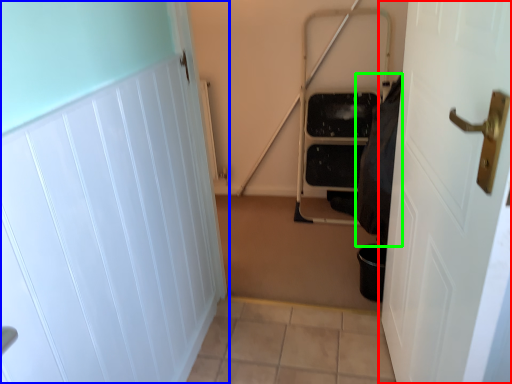
Question: Estimate the real-world distances between objects in this image. Which object is closer to door (highlighted by a red box), door (highlighted by a blue box) or material (highlighted by a green box)?

Choices:
 (A) door
 (B) material

Answer: (B)